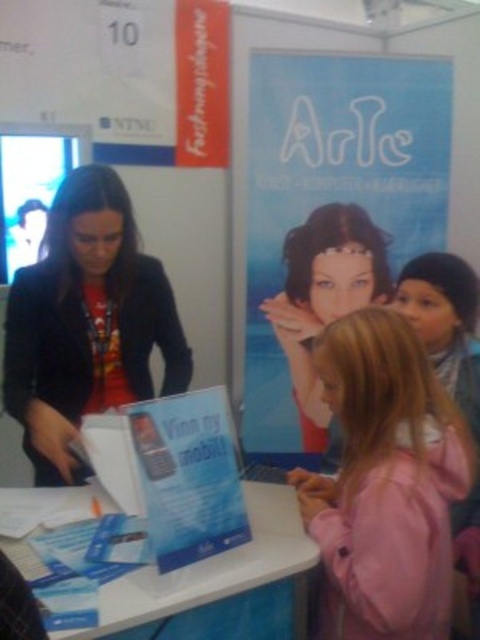
Based on the photo, you are at a trade show and need to place a 25 inch long banner between the matte black jacket at left and the white plastic table at lower center. Will there be enough space?

The distance between the matte black jacket at left and the white plastic table at lower center is 24.93 inches. Since the banner is 25 inches long, there is not enough space to place it between them without overlapping either object.

You are a photographer at the event and want to capture a clear shot of both the pink fabric jacket at lower right and the smooth matte face at center. Since the jacket is positioned under the face, will the face block the view of the jacket in the photo?

The pink fabric jacket at lower right is positioned under the smooth matte face at center, so the face may block part of the jacket in the photo.